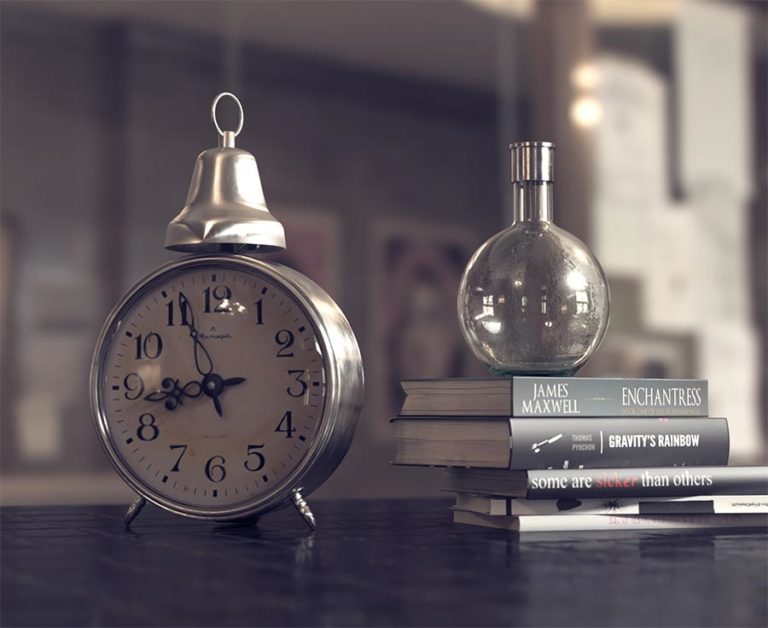
Locate an element on the screen. This screenshot has height=628, width=768. black table/countertop is located at coordinates (425, 578).